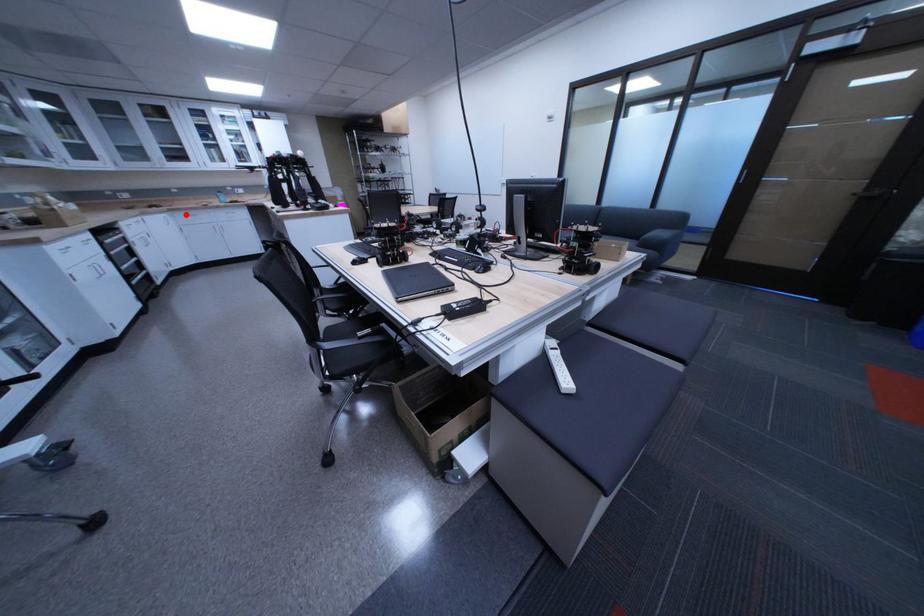
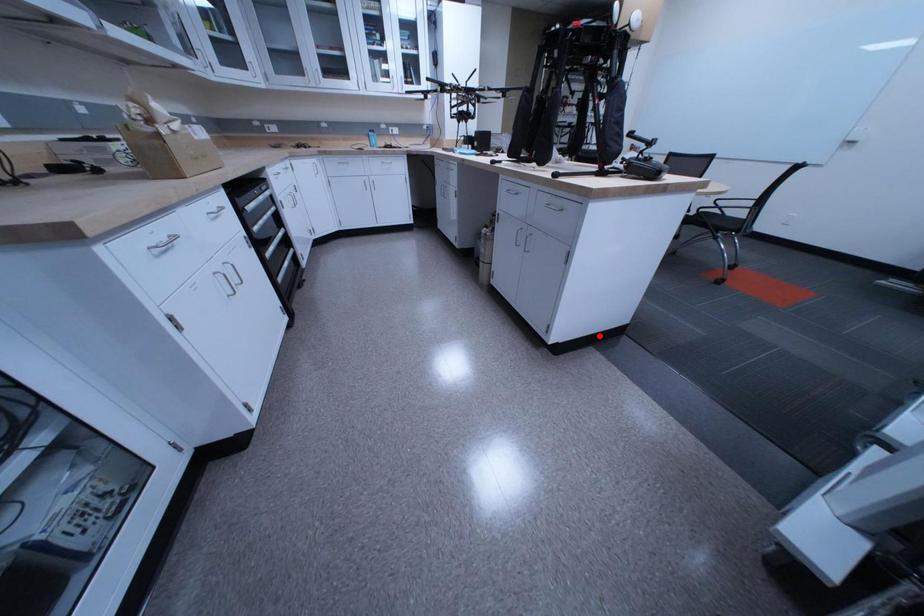
I am providing you with two images of the same scene from different viewpoints. A red point is marked on the first image and another point is marked on the second image. Is the red point in image1 aligned with the point shown in image2?

No